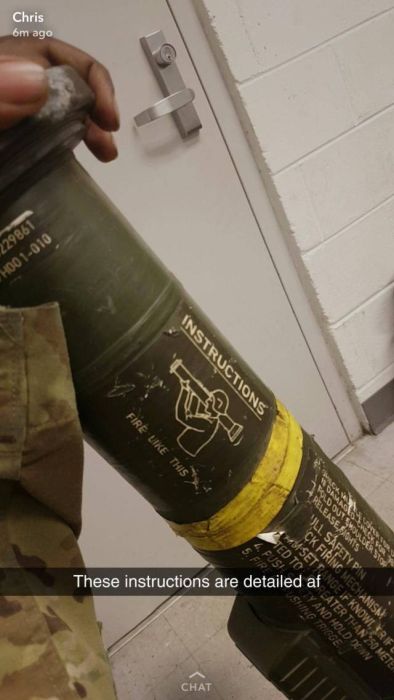
Image resolution: width=394 pixels, height=700 pixels. Identify the location of tiles. (213, 634).